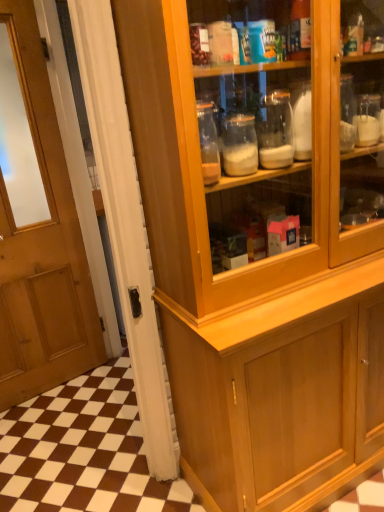
What is the approximate width of wooden door at left?

The width of wooden door at left is 4.42 inches.

The width and height of the screenshot is (384, 512). What do you see at coordinates (38, 229) in the screenshot?
I see `wooden door at left` at bounding box center [38, 229].

Where is `wooden door at left`? wooden door at left is located at coordinates (38, 229).

In order to face wooden cabinet at lower right, should I rotate leftwards or rightwards?

Rotate your view left by about 4.049°.

This screenshot has width=384, height=512. What do you see at coordinates (282, 393) in the screenshot?
I see `wooden cabinet at lower right` at bounding box center [282, 393].

The image size is (384, 512). I want to click on wooden cabinet at lower right, so click(282, 393).

What is the approximate height of wooden cabinet at lower right?

7.34 centimeters.

The width and height of the screenshot is (384, 512). In order to click on wooden door at left in this screenshot , I will do `click(38, 229)`.

Considering the relative positions of wooden cabinet at lower right and wooden door at left in the image provided, is wooden cabinet at lower right to the right of wooden door at left from the viewer's perspective?

Yes, wooden cabinet at lower right is to the right of wooden door at left.

Considering their positions, is wooden cabinet at lower right located in front of or behind wooden door at left?

In the image, wooden cabinet at lower right appears behind wooden door at left.

Does point (206, 467) appear closer or farther from the camera than point (79, 286)?

Point (206, 467) appears to be closer to the viewer than point (79, 286).

From the image's perspective, between wooden cabinet at lower right and wooden door at left, who is located below?

wooden cabinet at lower right, from the image's perspective.

From a real-world perspective, which is physically above, wooden cabinet at lower right or wooden door at left?

wooden door at left, from a real-world perspective.

Considering the relative sizes of wooden cabinet at lower right and wooden door at left in the image provided, is wooden cabinet at lower right thinner than wooden door at left?

In fact, wooden cabinet at lower right might be wider than wooden door at left.

Between wooden cabinet at lower right and wooden door at left, which one has more height?

wooden door at left is taller.

Between wooden cabinet at lower right and wooden door at left, which one has larger size?

wooden cabinet at lower right is bigger.

Based on the photo, is wooden cabinet at lower right inside or outside of wooden door at left?

The correct answer is: outside.

Consider the image. Is wooden cabinet at lower right touching wooden door at left?

No, wooden cabinet at lower right is not beside wooden door at left.

Consider the image. Is wooden cabinet at lower right looking in the opposite direction of wooden door at left?

No, wooden door at left is not at the back of wooden cabinet at lower right.

How different are the orientations of wooden cabinet at lower right and wooden door at left in degrees?

wooden cabinet at lower right and wooden door at left are facing 0.345 degrees away from each other.

Find the location of a particular element. This screenshot has width=384, height=512. door above the wooden cabinet at lower right (from the image's perspective) is located at coordinates (38, 229).

Can you confirm if wooden door at left is positioned to the left of wooden cabinet at lower right?

Yes.

Does wooden door at left lie in front of wooden cabinet at lower right?

Yes, wooden door at left is in front of wooden cabinet at lower right.

Does point (81, 340) come behind point (325, 408)?

Yes, it is.

From the image's perspective, who appears lower, wooden door at left or wooden cabinet at lower right?

wooden cabinet at lower right is shown below in the image.

From a real-world perspective, between wooden door at left and wooden cabinet at lower right, who is vertically higher?

wooden door at left, from a real-world perspective.

Considering the sizes of wooden door at left and wooden cabinet at lower right in the image, is wooden door at left wider or thinner than wooden cabinet at lower right?

Considering their sizes, wooden door at left looks slimmer than wooden cabinet at lower right.

Considering the sizes of objects wooden door at left and wooden cabinet at lower right in the image provided, who is taller, wooden door at left or wooden cabinet at lower right?

wooden door at left.

Does wooden door at left have a smaller size compared to wooden cabinet at lower right?

Correct, wooden door at left occupies less space than wooden cabinet at lower right.

Is wooden cabinet at lower right a part of wooden door at left?

No.

Are wooden door at left and wooden cabinet at lower right located far from each other?

Yes, wooden door at left and wooden cabinet at lower right are quite far apart.

Is wooden door at left aimed at wooden cabinet at lower right?

No, wooden door at left is not aimed at wooden cabinet at lower right.

Measure the distance between wooden door at left and wooden cabinet at lower right.

1.35 meters.

The height and width of the screenshot is (512, 384). I want to click on door to the left of wooden cabinet at lower right, so click(x=38, y=229).

At what (x,y) coordinates should I click in order to perform the action: click on door that is above the wooden cabinet at lower right (from a real-world perspective). Please return your answer as a coordinate pair (x, y). This screenshot has height=512, width=384. Looking at the image, I should click on (38, 229).

This screenshot has width=384, height=512. Identify the location of cabinetry on the right of the wooden door at left. (282, 393).